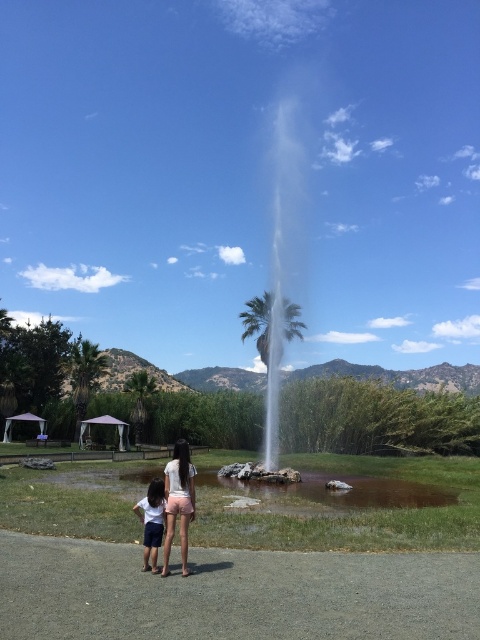
Question: Does white frothy water at center appear on the right side of light blue denim shorts at lower left?

Choices:
 (A) no
 (B) yes

Answer: (B)

Question: Can you confirm if pink fabric shorts at center is smaller than light blue denim shorts at lower left?

Choices:
 (A) no
 (B) yes

Answer: (A)

Question: Which point is closer to the camera taking this photo?

Choices:
 (A) (147, 529)
 (B) (184, 481)
 (C) (256, 344)

Answer: (A)

Question: Which object appears closest to the camera in this image?

Choices:
 (A) pink fabric shorts at center
 (B) white frothy water at center

Answer: (A)

Question: Which object is closer to the camera taking this photo?

Choices:
 (A) white frothy water at center
 (B) pink fabric shorts at center

Answer: (B)

Question: Is white frothy water at center above light blue denim shorts at lower left?

Choices:
 (A) yes
 (B) no

Answer: (A)